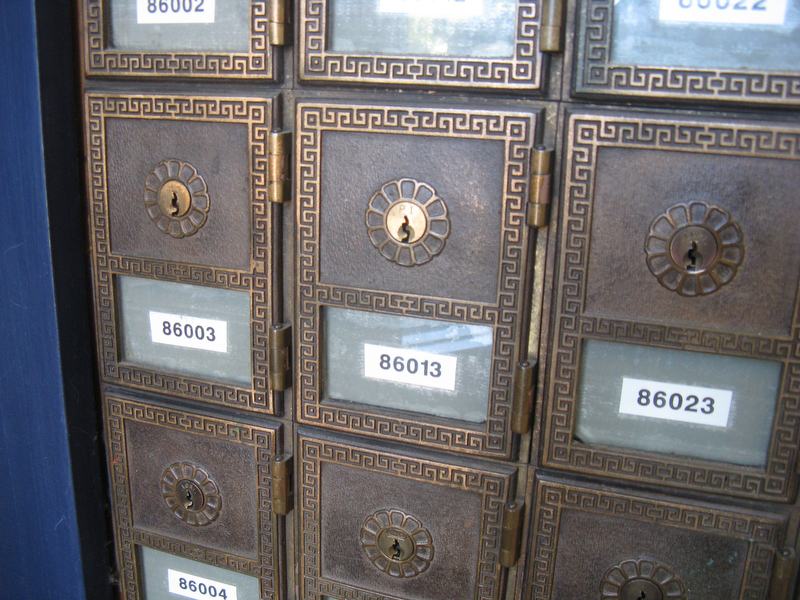
Where is `keyhole`? keyhole is located at coordinates (170, 197), (404, 225), (689, 253), (641, 593), (394, 547), (186, 501).